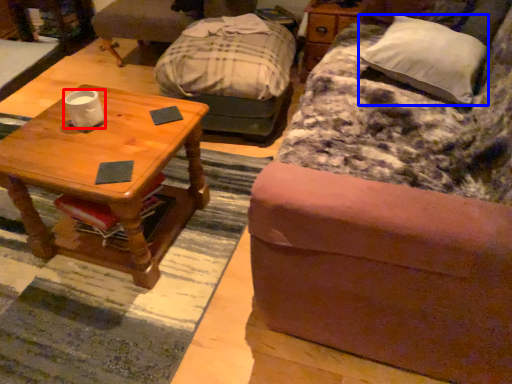
Question: Which of the following is the closest to the observer, coffee cup (highlighted by a red box) or pillow (highlighted by a blue box)?

Choices:
 (A) coffee cup
 (B) pillow

Answer: (B)